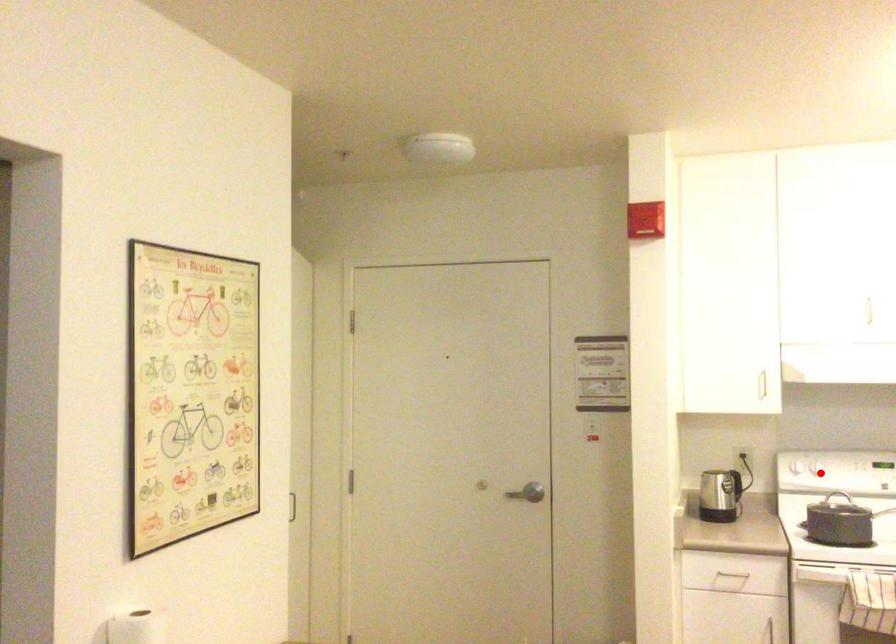
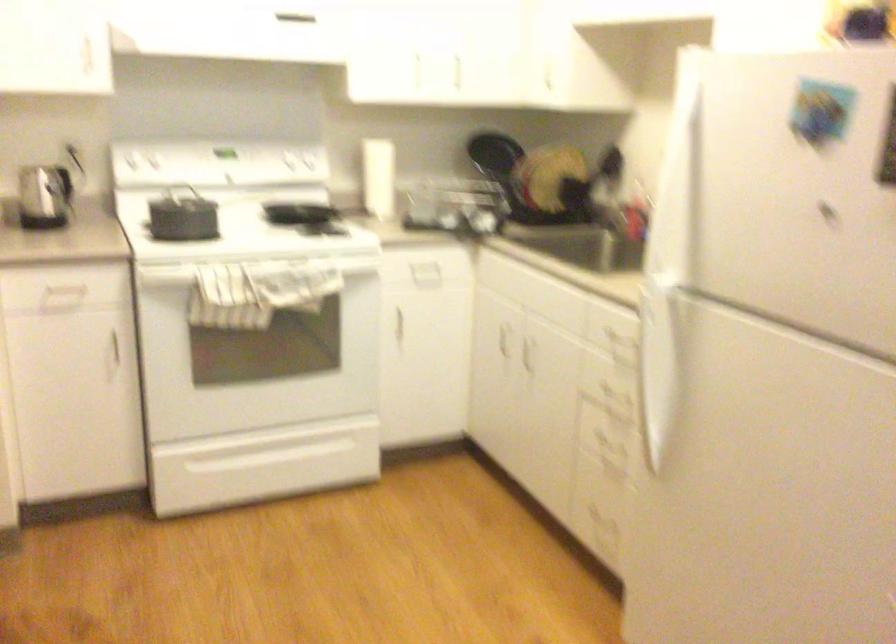
Find the pixel in the second image that matches the highlighted location in the first image.

(158, 171)